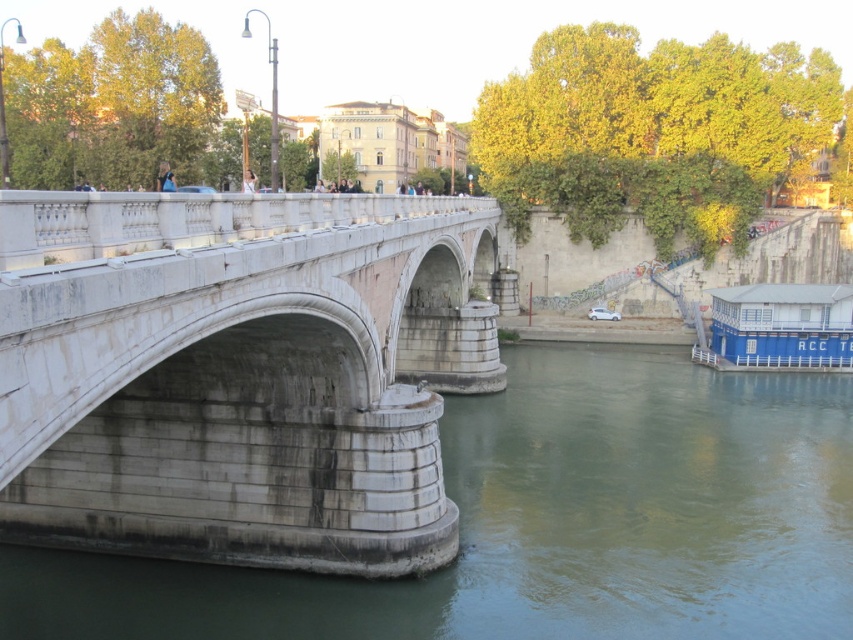
You are a delivery person needing to cross the white stone bridge at center to reach the delivery point on the other side. The greenish concrete river at lower left is flowing beneath the bridge. Can you safely cross the bridge without getting wet?

The white stone bridge at center is 10.61 meters away from the greenish concrete river at lower left, so yes, you can safely cross the bridge without getting wet as the distance between them ensures the bridge is elevated above the river.

You are a city planner reviewing this riverside area. You need to determine if the white stone bridge at center can accommodate a new pedestrian walkway that requires a minimum width of 3 meters. The greenish concrete river at lower left has a width of 2 meters. Can the bridge support the walkway based on their sizes?

The white stone bridge at center is larger in size than the greenish concrete river at lower left, which has a width of 2 meters. Therefore, the bridge is likely wider than 2 meters. Since the required minimum width for the pedestrian walkway is 3 meters, the bridge may be sufficient if its actual width meets or exceeds this requirement. However, without exact measurements, we can only infer based on relative size.